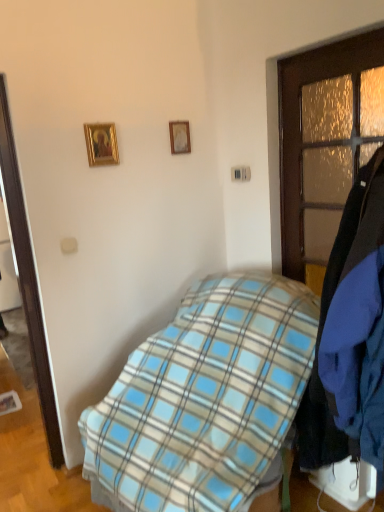
Question: From a real-world perspective, is wooden picture frame at upper center, the 1th picture frame in the right-to-left sequence, beneath blue plaid blanket at center?

Choices:
 (A) yes
 (B) no

Answer: (B)

Question: Considering the relative sizes of wooden picture frame at upper center, which is the second picture frame from front to back, and blue plaid blanket at center in the image provided, is wooden picture frame at upper center, which is the second picture frame from front to back, wider than blue plaid blanket at center?

Choices:
 (A) yes
 (B) no

Answer: (B)

Question: Is wooden picture frame at upper center, the 2th picture frame from the left, thinner than blue plaid blanket at center?

Choices:
 (A) no
 (B) yes

Answer: (B)

Question: From the image's perspective, would you say wooden picture frame at upper center, the 2th picture frame from the left, is shown under blue plaid blanket at center?

Choices:
 (A) no
 (B) yes

Answer: (A)

Question: Is wooden picture frame at upper center, the 1th picture frame in the back-to-front sequence, taller than blue plaid blanket at center?

Choices:
 (A) yes
 (B) no

Answer: (B)

Question: Considering the positions of wooden door at right and gold-framed picture at upper left, the 2th picture frame in the back-to-front sequence, in the image, is wooden door at right taller or shorter than gold-framed picture at upper left, the 2th picture frame in the back-to-front sequence,?

Choices:
 (A) tall
 (B) short

Answer: (A)

Question: Based on their positions, is wooden door at right located to the left or right of gold-framed picture at upper left, arranged as the 2th picture frame when viewed from the right?

Choices:
 (A) right
 (B) left

Answer: (A)

Question: From the image's perspective, is wooden door at right located above or below gold-framed picture at upper left, arranged as the 2th picture frame when viewed from the right?

Choices:
 (A) above
 (B) below

Answer: (B)

Question: From a real-world perspective, is wooden door at right positioned above or below gold-framed picture at upper left, the first picture frame viewed from the front?

Choices:
 (A) below
 (B) above

Answer: (A)

Question: Is point (89, 152) positioned closer to the camera than point (178, 150)?

Choices:
 (A) closer
 (B) farther

Answer: (A)

Question: Based on their sizes in the image, would you say gold-framed picture at upper left, the first picture frame when ordered from left to right, is bigger or smaller than wooden picture frame at upper center, the 2th picture frame from the left?

Choices:
 (A) small
 (B) big

Answer: (B)

Question: Is gold-framed picture at upper left, the 2th picture frame in the back-to-front sequence, in front of or behind wooden picture frame at upper center, the 2th picture frame from the left, in the image?

Choices:
 (A) front
 (B) behind

Answer: (A)

Question: From a real-world perspective, is gold-framed picture at upper left, the first picture frame when ordered from left to right, positioned above or below wooden picture frame at upper center, the 1th picture frame in the back-to-front sequence?

Choices:
 (A) below
 (B) above

Answer: (A)

Question: Considering the positions of point (180, 147) and point (248, 462), is point (180, 147) closer or farther from the camera than point (248, 462)?

Choices:
 (A) closer
 (B) farther

Answer: (B)

Question: Is wooden picture frame at upper center, the 1th picture frame in the right-to-left sequence, taller or shorter than blue plaid blanket at center?

Choices:
 (A) tall
 (B) short

Answer: (B)